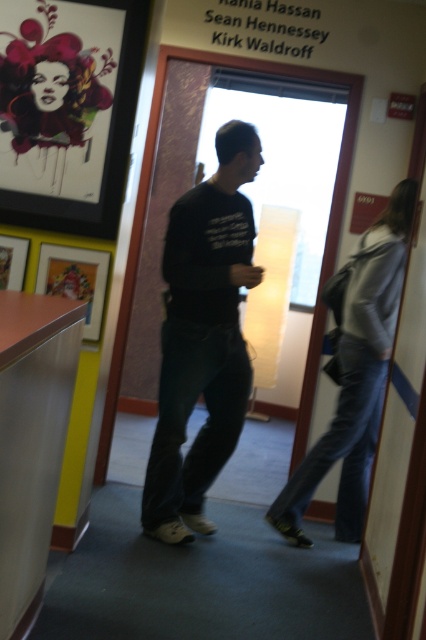
From the picture: Is painted paper portrait at upper left in front of metallic silver desk at lower left?

No, it is behind metallic silver desk at lower left.

From the picture: Who is more forward, (85, 166) or (28, 321)?

Point (28, 321)

Locate an element on the screen. This screenshot has height=640, width=426. painted paper portrait at upper left is located at coordinates (55, 96).

The image size is (426, 640). Identify the location of painted paper portrait at upper left. (55, 96).

Does point (31, 492) come farther from viewer compared to point (299, 467)?

No, (31, 492) is closer to viewer.

Can you confirm if metallic silver desk at lower left is thinner than denim jacket at right?

Yes.

Consider the image. Measure the distance between metallic silver desk at lower left and camera.

The distance of metallic silver desk at lower left from camera is 1.31 meters.

This screenshot has width=426, height=640. Find the location of `metallic silver desk at lower left`. metallic silver desk at lower left is located at coordinates (31, 440).

Which is above, black matte shirt at center or painted paper portrait at upper left?

painted paper portrait at upper left is higher up.

In the scene shown: Is black matte shirt at center smaller than painted paper portrait at upper left?

No.

Which is behind, point (236, 396) or point (34, 74)?

The point (236, 396) is behind.

Locate an element on the screen. This screenshot has width=426, height=640. black matte shirt at center is located at coordinates pos(203,337).